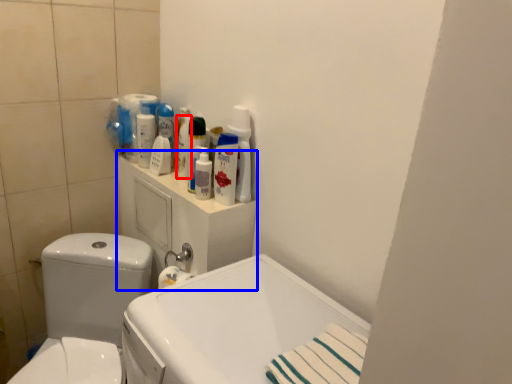
Question: Among these objects, which one is nearest to the camera, cleaning product (highlighted by a red box) or medicine cabinet (highlighted by a blue box)?

Choices:
 (A) cleaning product
 (B) medicine cabinet

Answer: (B)